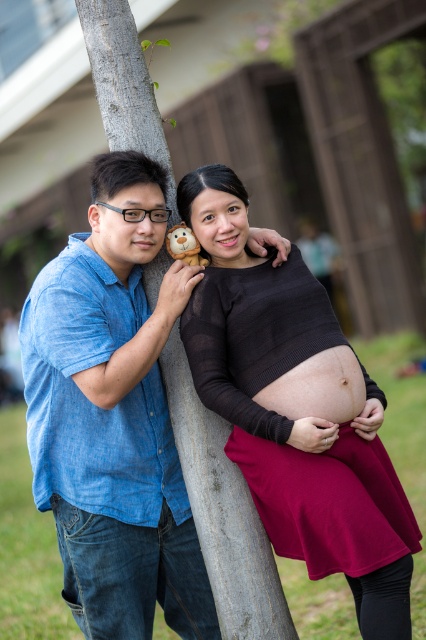
Does blue denim shirt at left lie in front of gray rough tree trunk at center?

Yes.

Can you confirm if blue denim shirt at left is shorter than gray rough tree trunk at center?

Incorrect, blue denim shirt at left's height does not fall short of gray rough tree trunk at center's.

Which is behind, point (42, 365) or point (287, 609)?

Point (287, 609)

I want to click on blue denim shirt at left, so click(x=114, y=416).

Who is shorter, blue denim shirt at left or matte black sweater at center?

Standing shorter between the two is matte black sweater at center.

Identify the location of blue denim shirt at left. The width and height of the screenshot is (426, 640). (114, 416).

You are a GUI agent. You are given a task and a screenshot of the screen. Output one action in this format:
    pyautogui.click(x=<x>, y=<y>)
    Task: Click on the blue denim shirt at left
    
    Given the screenshot: What is the action you would take?
    pyautogui.click(x=114, y=416)

Can you confirm if blue denim shirt at left is positioned below smooth skin belly at center?

Indeed, blue denim shirt at left is positioned under smooth skin belly at center.

Does blue denim shirt at left have a lesser height compared to smooth skin belly at center?

Incorrect, blue denim shirt at left's height does not fall short of smooth skin belly at center's.

This screenshot has width=426, height=640. In order to click on blue denim shirt at left in this screenshot , I will do `click(114, 416)`.